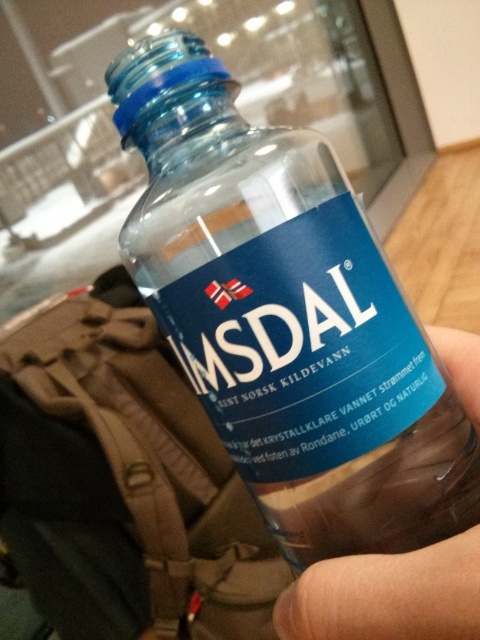
Question: Can you confirm if transparent glass bottle at center is positioned above transparent plastic hand at lower right?

Choices:
 (A) yes
 (B) no

Answer: (A)

Question: Is transparent glass bottle at center positioned at the back of transparent plastic hand at lower right?

Choices:
 (A) no
 (B) yes

Answer: (B)

Question: Which point is farther to the camera?

Choices:
 (A) (384, 572)
 (B) (371, 387)

Answer: (B)

Question: In this image, where is transparent glass bottle at center located relative to transparent plastic hand at lower right?

Choices:
 (A) above
 (B) below

Answer: (A)